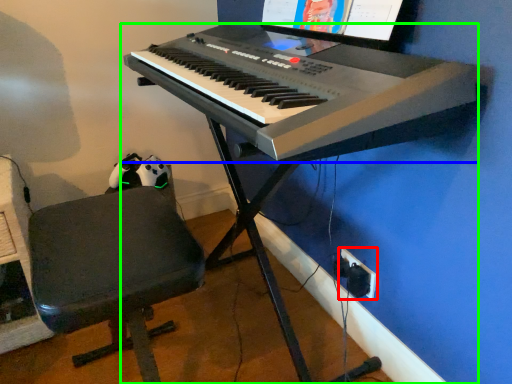
Question: Considering the real-world distances, which object is closest to plug (highlighted by a red box)? musical keyboard (highlighted by a blue box) or piano (highlighted by a green box).

Choices:
 (A) musical keyboard
 (B) piano

Answer: (B)